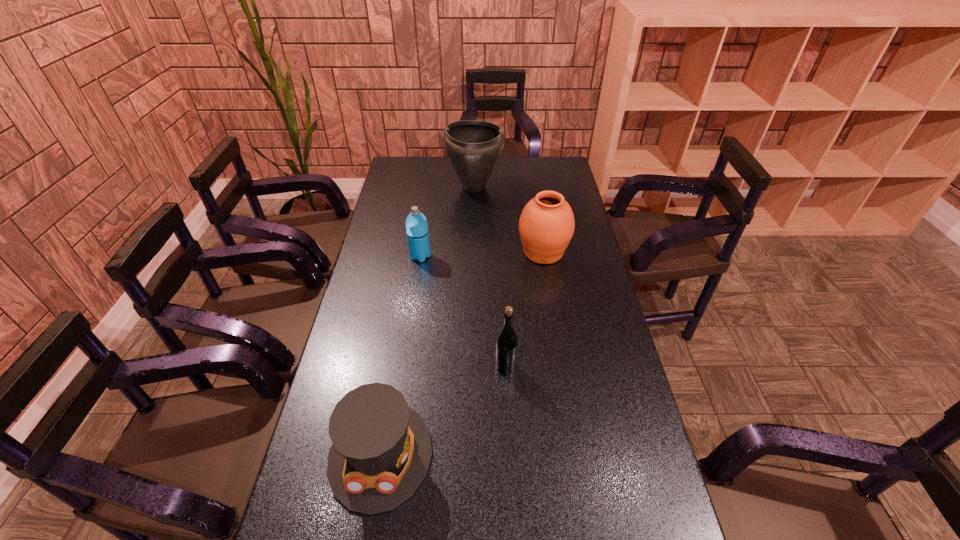
Select which object is the third closest to the farther urn. Please provide its 2D coordinates. Your answer should be formatted as a tuple, i.e. [(x, y)], where the tuple contains the x and y coordinates of a point satisfying the conditions above.

[(506, 346)]

Where is `object identified as the closest to the second nearest object`? The height and width of the screenshot is (540, 960). object identified as the closest to the second nearest object is located at coordinates (381, 451).